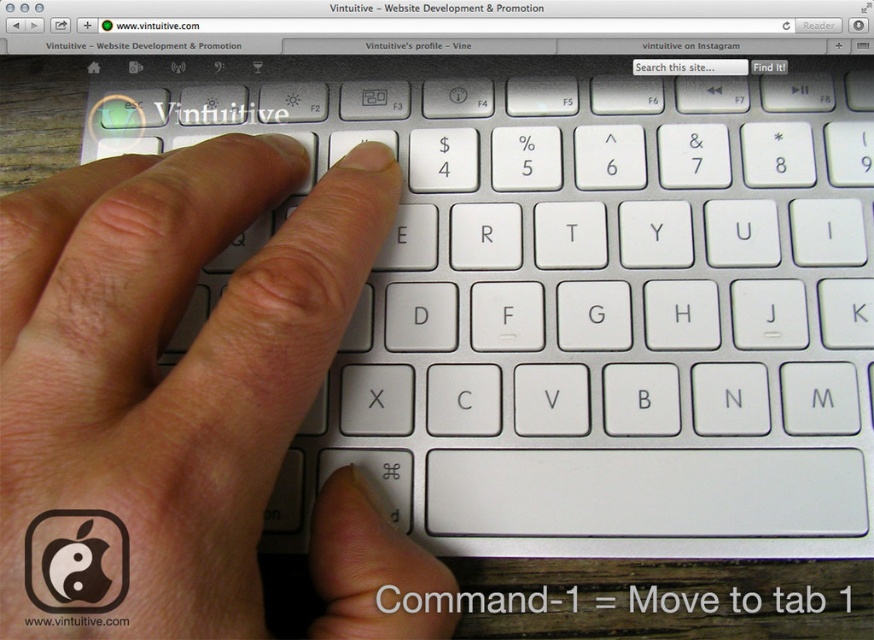
Question: Can you confirm if white plastic keyboard at center is wider than white matte finger at center?

Choices:
 (A) no
 (B) yes

Answer: (B)

Question: Among these points, which one is nearest to the camera?

Choices:
 (A) (480, 408)
 (B) (318, 538)

Answer: (B)

Question: Which point is farther to the camera?

Choices:
 (A) [x=390, y=627]
 (B) [x=764, y=81]

Answer: (B)

Question: Can you confirm if white plastic keyboard at center is smaller than white matte finger at center?

Choices:
 (A) no
 (B) yes

Answer: (A)

Question: Is white plastic keyboard at center above white matte finger at center?

Choices:
 (A) yes
 (B) no

Answer: (A)

Question: Among these points, which one is farthest from the camera?

Choices:
 (A) (1, 468)
 (B) (820, 120)

Answer: (B)